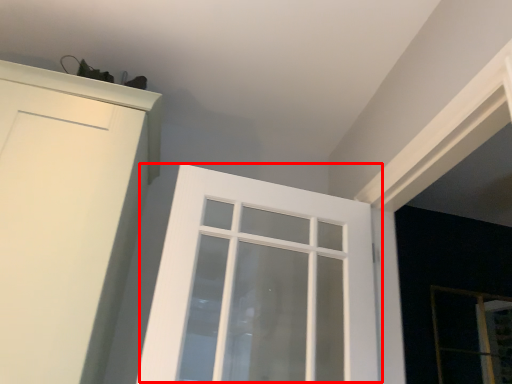
Question: From the image's perspective, what is the correct spatial positioning of window (annotated by the red box) in reference to screen door?

Choices:
 (A) below
 (B) above

Answer: (B)